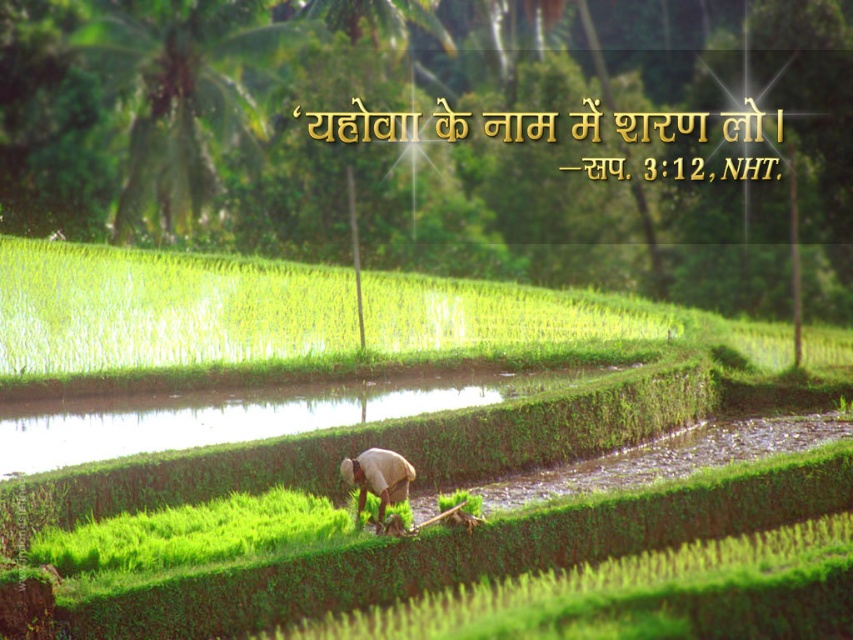
You are a farmer in the rice paddy field. You see green grass at center and light brown fabric at center. Which object is closer to you?

The green grass at center is closer to you because it is positioned over the light brown fabric at center.

You are a drone operator tasked with capturing aerial footage of the rice paddy field. The green grass at center is your primary focus. Based on its coordinates, can you determine if it is positioned closer to the top or bottom of the image?

The green grass at center is located at point 0.648 on the vertical axis. Since the vertical coordinate ranges from 0 at the bottom to 1 at the top, a value of 0.648 places it closer to the bottom of the image.

You are a farmer in the rice paddy field. You notice the green grass at center and the light brown fabric at center. Which object is wider?

The green grass at center is wider than the light brown fabric at center.